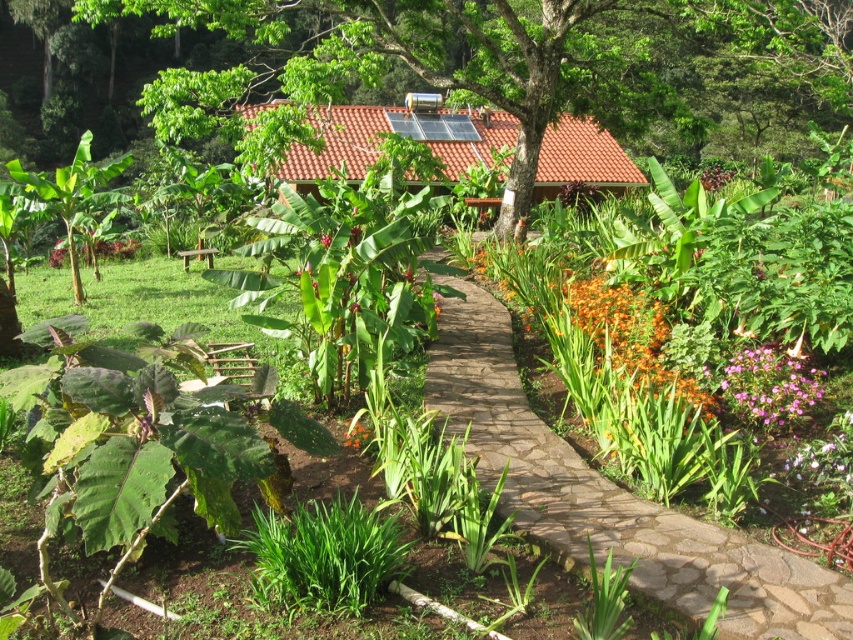
You are standing at the entrance of the garden and want to take a photo of the green leafy tree at upper center. If your camera has a maximum focus range of 15 meters, will it be able to capture the tree clearly?

The green leafy tree at upper center and camera are 15.88 meters apart, which exceeds the camera maximum focus range of 15 meters. Therefore, the camera cannot capture the tree clearly.